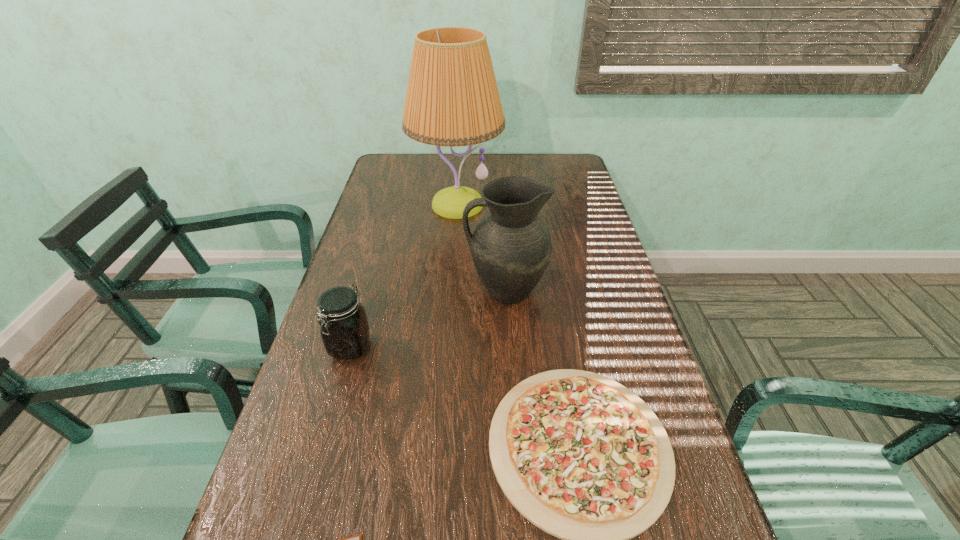
At what (x,y) coordinates should I click in order to perform the action: click on free space located 0.220m on the lid of the third tallest object. Please return your answer as a coordinate pair (x, y). This screenshot has height=540, width=960. Looking at the image, I should click on (319, 460).

Image resolution: width=960 pixels, height=540 pixels. I want to click on object present at the far edge, so click(x=452, y=99).

Locate an element on the screen. The width and height of the screenshot is (960, 540). lamp that is at the left edge is located at coordinates (452, 99).

The image size is (960, 540). Identify the location of jar located in the left edge section of the desktop. (344, 328).

Where is `object that is positioned at the far left corner`? This screenshot has height=540, width=960. object that is positioned at the far left corner is located at coordinates (452, 99).

This screenshot has height=540, width=960. I want to click on free spot at the far edge of the desktop, so coord(499,168).

I want to click on vacant space at the left edge, so point(314,412).

Where is `vacant space at the right edge of the desktop`? The width and height of the screenshot is (960, 540). vacant space at the right edge of the desktop is located at coordinates (569, 226).

In the image, there is a desktop. Where is `vacant space at the far right corner`? vacant space at the far right corner is located at coordinates (579, 167).

Find the location of a particular element. unoccupied position between the farthest object and the jar is located at coordinates (404, 276).